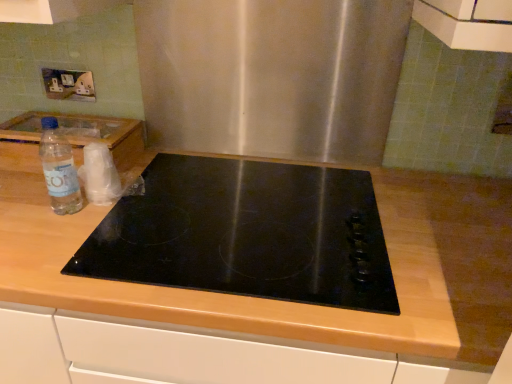
Question: From a real-world perspective, is clear plastic bottle at left positioned over wooden at center based on gravity?

Choices:
 (A) no
 (B) yes

Answer: (B)

Question: From the image's perspective, does clear plastic bottle at left appear lower than wooden at center?

Choices:
 (A) no
 (B) yes

Answer: (A)

Question: Considering the relative sizes of clear plastic bottle at left and wooden at center in the image provided, is clear plastic bottle at left thinner than wooden at center?

Choices:
 (A) yes
 (B) no

Answer: (A)

Question: Can we say clear plastic bottle at left lies outside wooden at center?

Choices:
 (A) yes
 (B) no

Answer: (A)

Question: From a real-world perspective, is clear plastic bottle at left located beneath wooden at center?

Choices:
 (A) yes
 (B) no

Answer: (B)

Question: Considering the relative positions of clear plastic bottle at left and wooden at center in the image provided, is clear plastic bottle at left to the left of wooden at center from the viewer's perspective?

Choices:
 (A) yes
 (B) no

Answer: (A)

Question: From the image's perspective, is wooden at center on top of clear plastic bottle at left?

Choices:
 (A) yes
 (B) no

Answer: (B)

Question: Does wooden at center have a larger size compared to clear plastic bottle at left?

Choices:
 (A) no
 (B) yes

Answer: (B)

Question: Can you confirm if wooden at center is smaller than clear plastic bottle at left?

Choices:
 (A) yes
 (B) no

Answer: (B)

Question: Does wooden at center have a greater width compared to clear plastic bottle at left?

Choices:
 (A) no
 (B) yes

Answer: (B)

Question: Does wooden at center appear on the right side of clear plastic bottle at left?

Choices:
 (A) no
 (B) yes

Answer: (B)

Question: From the image's perspective, is wooden at center under clear plastic bottle at left?

Choices:
 (A) no
 (B) yes

Answer: (B)

Question: From a real-world perspective, is black glass cooktop at center on top of wooden at center?

Choices:
 (A) yes
 (B) no

Answer: (A)